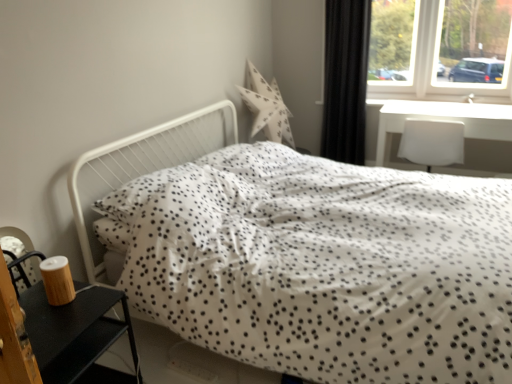
Question: Can you confirm if white plastic chair at right is bigger than white dotted fabric bed at center?

Choices:
 (A) yes
 (B) no

Answer: (B)

Question: Can you confirm if white plastic chair at right is positioned to the right of white dotted fabric bed at center?

Choices:
 (A) no
 (B) yes

Answer: (B)

Question: Does white plastic chair at right touch white dotted fabric bed at center?

Choices:
 (A) no
 (B) yes

Answer: (A)

Question: Would you say white dotted fabric bed at center is part of white plastic chair at right's contents?

Choices:
 (A) yes
 (B) no

Answer: (B)

Question: Is white plastic chair at right taller than white dotted fabric bed at center?

Choices:
 (A) yes
 (B) no

Answer: (B)

Question: Does white plastic chair at right appear on the left side of white dotted fabric bed at center?

Choices:
 (A) no
 (B) yes

Answer: (A)

Question: Would you say wooden candle holder at lower left is a long distance from transparent glass window at upper right?

Choices:
 (A) yes
 (B) no

Answer: (A)

Question: From the image's perspective, would you say wooden candle holder at lower left is positioned over transparent glass window at upper right?

Choices:
 (A) no
 (B) yes

Answer: (A)

Question: From a real-world perspective, is wooden candle holder at lower left located higher than transparent glass window at upper right?

Choices:
 (A) no
 (B) yes

Answer: (A)

Question: From the image's perspective, does wooden candle holder at lower left appear lower than transparent glass window at upper right?

Choices:
 (A) no
 (B) yes

Answer: (B)

Question: Can you confirm if wooden candle holder at lower left is smaller than transparent glass window at upper right?

Choices:
 (A) no
 (B) yes

Answer: (B)

Question: Considering the relative sizes of wooden candle holder at lower left and transparent glass window at upper right in the image provided, is wooden candle holder at lower left taller than transparent glass window at upper right?

Choices:
 (A) no
 (B) yes

Answer: (A)

Question: Could you tell me if black fabric curtain at upper right is facing white plastic chair at right?

Choices:
 (A) no
 (B) yes

Answer: (A)